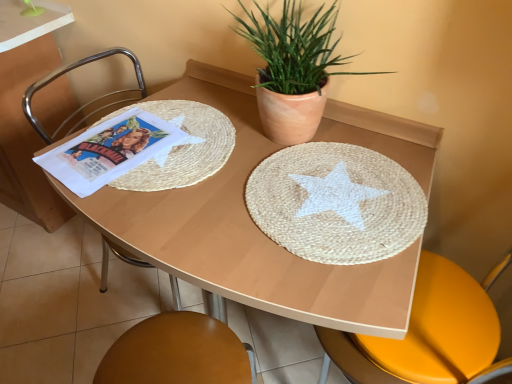
Question: Is natural fiber placemat at center outside wooden table at center?

Choices:
 (A) no
 (B) yes

Answer: (A)

Question: Is natural fiber placemat at center bigger than wooden table at center?

Choices:
 (A) no
 (B) yes

Answer: (A)

Question: From a real-world perspective, is natural fiber placemat at center below wooden table at center?

Choices:
 (A) no
 (B) yes

Answer: (A)

Question: Would you consider natural fiber placemat at center to be distant from wooden table at center?

Choices:
 (A) yes
 (B) no

Answer: (B)

Question: From a real-world perspective, does natural fiber placemat at center stand above wooden table at center?

Choices:
 (A) yes
 (B) no

Answer: (A)

Question: Is natural fiber placemat at center taller than wooden table at center?

Choices:
 (A) no
 (B) yes

Answer: (A)

Question: From the image's perspective, is wooden table at center under natural fiber placemat at center?

Choices:
 (A) no
 (B) yes

Answer: (B)

Question: Can natural fiber placemat at center be found inside wooden table at center?

Choices:
 (A) yes
 (B) no

Answer: (A)

Question: Does wooden table at center come behind natural fiber placemat at center?

Choices:
 (A) no
 (B) yes

Answer: (A)

Question: Does wooden table at center have a larger size compared to natural fiber placemat at center?

Choices:
 (A) no
 (B) yes

Answer: (B)

Question: Is wooden table at center looking in the opposite direction of natural fiber placemat at center?

Choices:
 (A) no
 (B) yes

Answer: (A)

Question: From a real-world perspective, is wooden table at center located higher than natural fiber placemat at center?

Choices:
 (A) no
 (B) yes

Answer: (A)

Question: Is natural fiber placemat at center taller than terracotta clay pot at upper center?

Choices:
 (A) yes
 (B) no

Answer: (B)